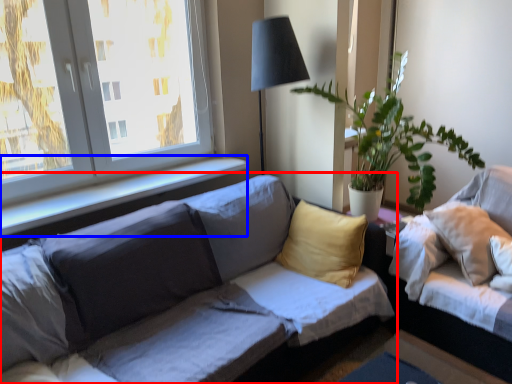
Question: Among these objects, which one is farthest to the camera, studio couch (highlighted by a red box) or window sill (highlighted by a blue box)?

Choices:
 (A) studio couch
 (B) window sill

Answer: (B)